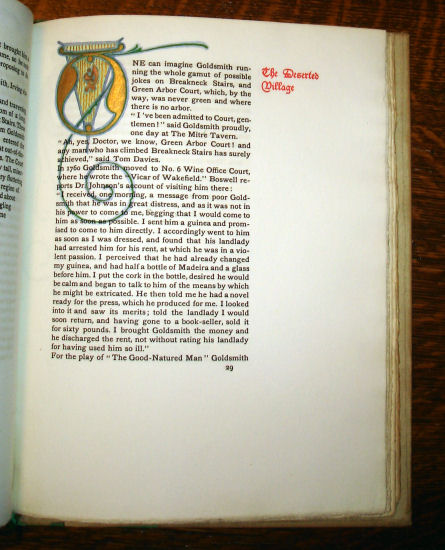
You are a GUI agent. You are given a task and a screenshot of the screen. Output one action in this format:
    pyautogui.click(x=<x>, y=<y>)
    Task: Click on the cover
    
    Given the screenshot: What is the action you would take?
    pyautogui.click(x=402, y=516)